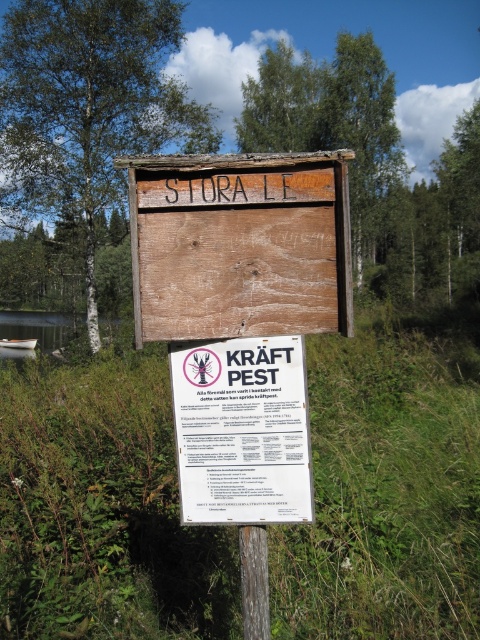
Question: Which point is closer to the camera?

Choices:
 (A) (82, 321)
 (B) (94, 253)
 (C) (146, 548)

Answer: (C)

Question: From the image, what is the correct spatial relationship of green grass at lower center in relation to weathered wood sign at center?

Choices:
 (A) right
 (B) left

Answer: (A)

Question: Is green grass at lower center thinner than white paper poster at center?

Choices:
 (A) yes
 (B) no

Answer: (B)

Question: Which point is closer to the camera taking this photo?

Choices:
 (A) (242, 544)
 (B) (397, 173)

Answer: (A)

Question: Considering the real-world distances, which object is farthest from the green leafy tree at upper left?

Choices:
 (A) green grass at lower center
 (B) white paper poster at center
 (C) brushed metal water at lower left

Answer: (B)

Question: Is green grass at lower center positioned behind white plastic canoe at left?

Choices:
 (A) no
 (B) yes

Answer: (A)